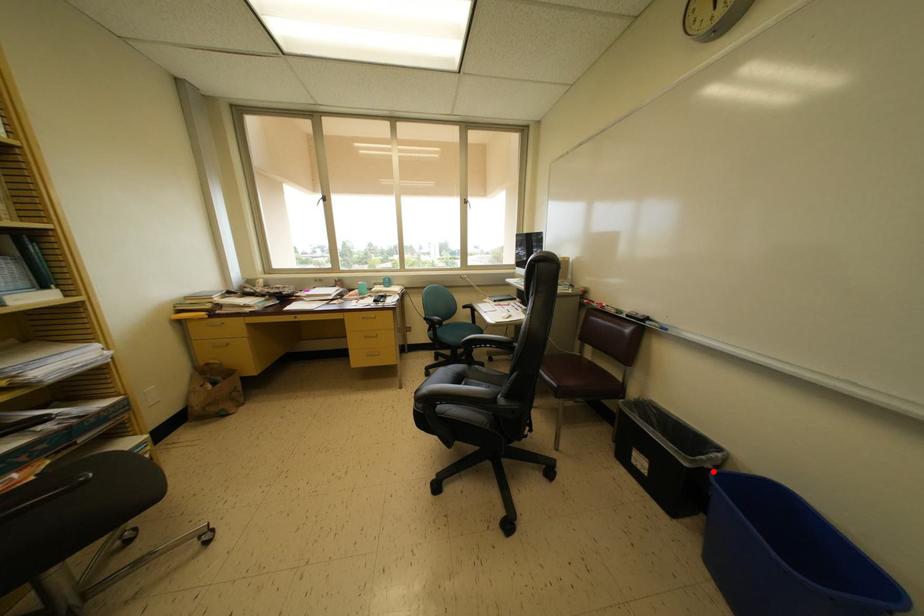
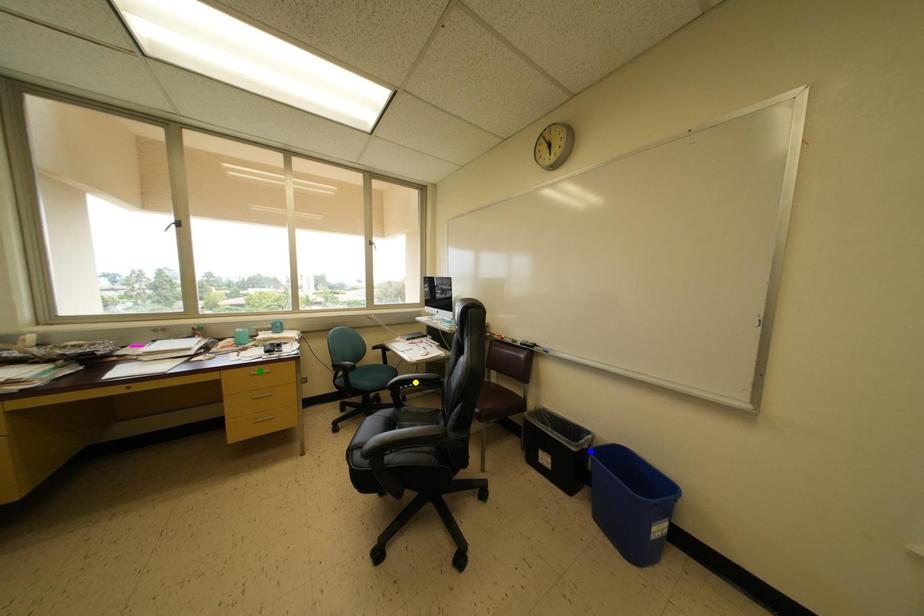
Question: I am providing you with two images of the same scene from different viewpoints. A red point is marked on the first image. You are given multiple points on the second image. Which mark in image 2 goes with the point in image 1?

Choices:
 (A) green point
 (B) blue point
 (C) yellow point

Answer: (B)